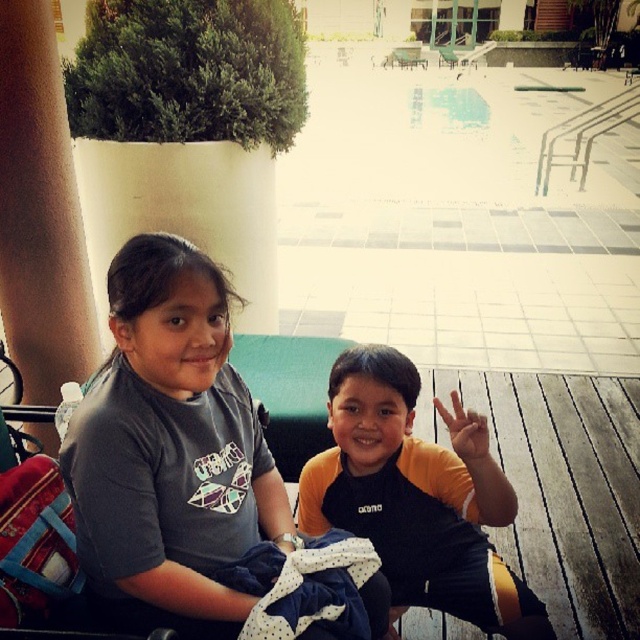
You are a photographer setting up a shoot in the described scene. You need to place a small tripod between the gray cotton shirt at center and the wooden bench at center so that it is closer to the taller object. Where should you place the tripod?

The gray cotton shirt at center has a lesser height compared to wooden bench at center, so the tripod should be placed closer to the wooden bench at center since it is the taller object.

You are a photographer trying to capture a clear shot of the wooden bench at center. However, the gray cotton shirt at center is blocking your view. Can you move the shirt to the side to get an unobstructed view of the bench?

The gray cotton shirt at center is in front of the wooden bench at center, so moving the shirt aside would allow you to see the bench without obstruction.